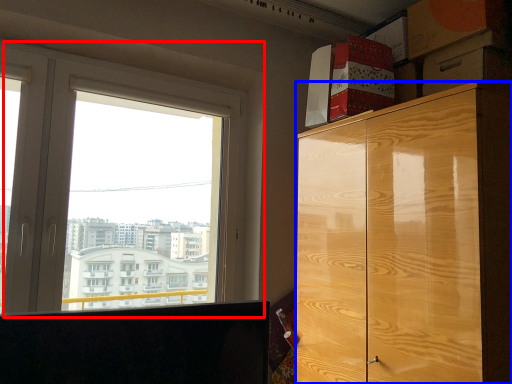
Question: Which point is further to the camera, window (highlighted by a red box) or cabinetry (highlighted by a blue box)?

Choices:
 (A) window
 (B) cabinetry

Answer: (A)